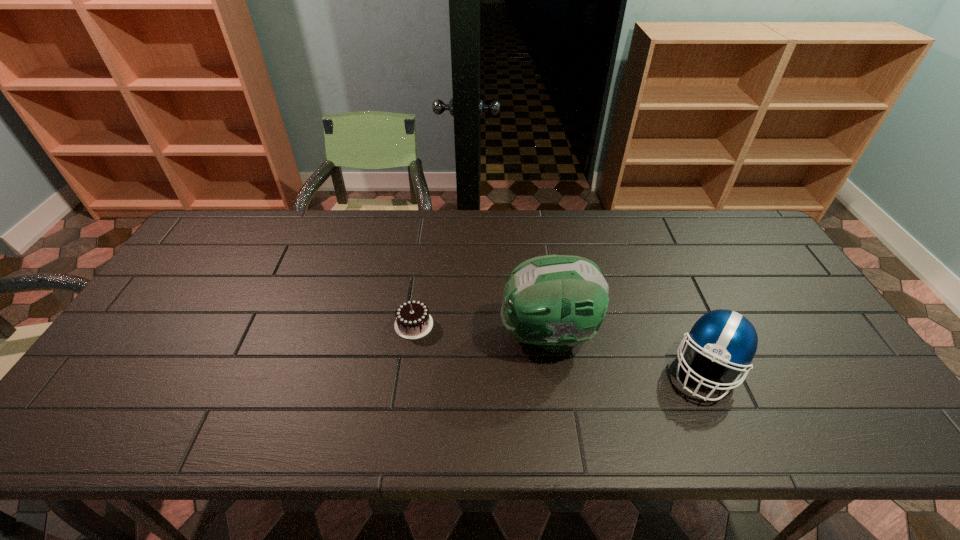
In order to click on the second object from right to left in this screenshot , I will do `click(557, 302)`.

Locate an element on the screen. Image resolution: width=960 pixels, height=540 pixels. the taller football helmet is located at coordinates (557, 302).

Where is `the right football helmet`? the right football helmet is located at coordinates (726, 337).

At what (x,y) coordinates should I click in order to perform the action: click on the shorter football helmet. Please return your answer as a coordinate pair (x, y). The width and height of the screenshot is (960, 540). Looking at the image, I should click on (726, 337).

Image resolution: width=960 pixels, height=540 pixels. What are the coordinates of `the leftmost object` in the screenshot? It's located at 413,321.

Locate an element on the screen. The width and height of the screenshot is (960, 540). the shortest object is located at coordinates (413, 321).

The width and height of the screenshot is (960, 540). In order to click on vacant space located on the visor of the tallest object in this screenshot , I will do `click(404, 335)`.

At what (x,y) coordinates should I click in order to perform the action: click on vacant space located on the visor of the tallest object. Please return your answer as a coordinate pair (x, y). The height and width of the screenshot is (540, 960). Looking at the image, I should click on (363, 335).

Where is `vacant space located 0.360m on the visor of the tallest object`? vacant space located 0.360m on the visor of the tallest object is located at coordinates (363, 335).

Where is `vacant space located at the front of the rightmost object with the faceguard`? The image size is (960, 540). vacant space located at the front of the rightmost object with the faceguard is located at coordinates (733, 431).